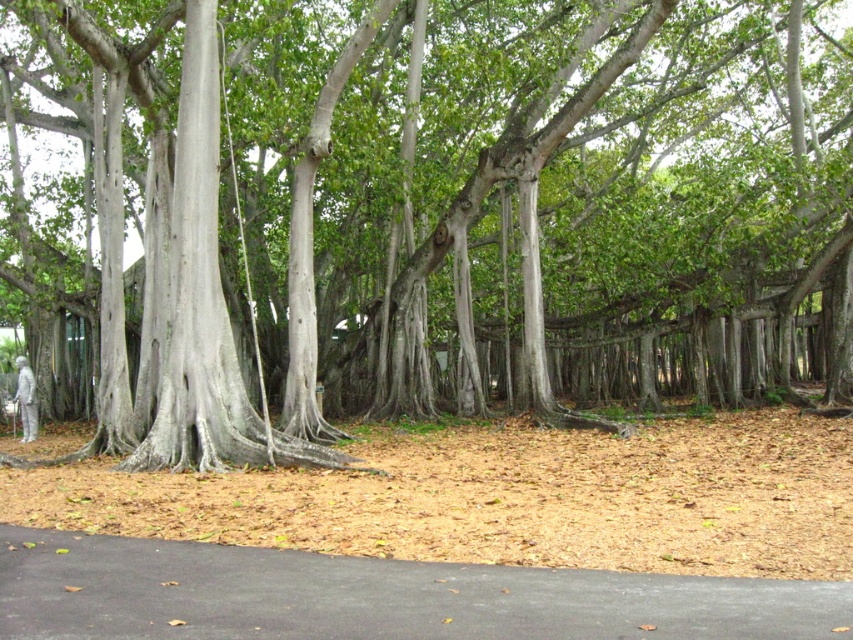
Can you confirm if green leafy tree at center is thinner than silver metallic statue at lower left?

Incorrect, green leafy tree at center's width is not less than silver metallic statue at lower left's.

Is green leafy tree at center taller than silver metallic statue at lower left?

Yes.

Who is more distant from viewer, (314, 428) or (22, 378)?

The point (22, 378) is more distant.

Locate an element on the screen. The height and width of the screenshot is (640, 853). green leafy tree at center is located at coordinates point(473,209).

Can you confirm if black asphalt path at lower center is bigger than smooth gray bark at left?

Correct, black asphalt path at lower center is larger in size than smooth gray bark at left.

The width and height of the screenshot is (853, 640). Identify the location of black asphalt path at lower center. (375, 596).

Where is `black asphalt path at lower center`? black asphalt path at lower center is located at coordinates (375, 596).

Between black asphalt path at lower center and silver metallic statue at lower left, which one has more height?

silver metallic statue at lower left

What are the coordinates of `black asphalt path at lower center` in the screenshot? It's located at (375, 596).

Find the location of a particular element. black asphalt path at lower center is located at coordinates (375, 596).